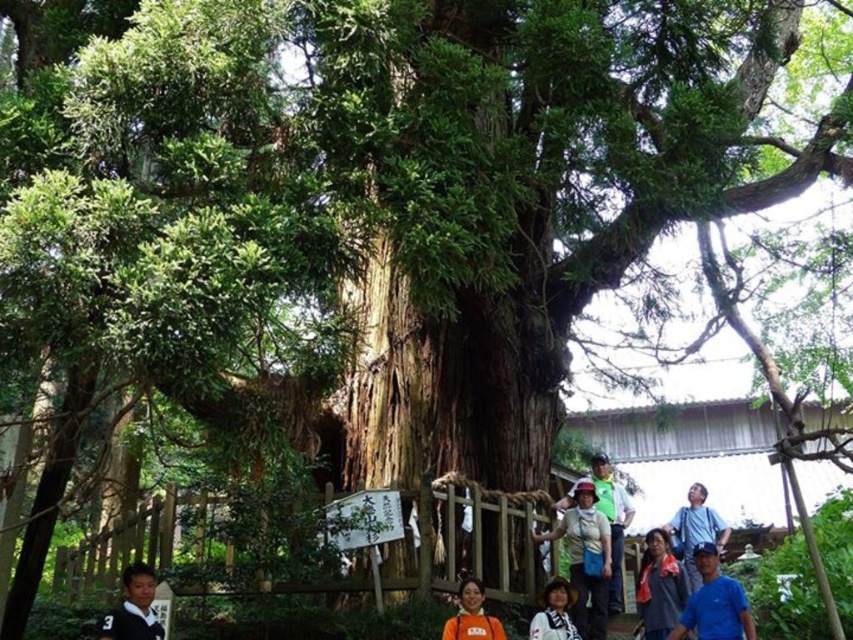
Question: Estimate the real-world distances between objects in this image. Which object is closer to the matte black shirt at lower left?

Choices:
 (A) matte black shirt at lower center
 (B) blue shirt at lower right
 (C) blue fabric shirt at lower right

Answer: (C)

Question: Can you confirm if matte blue shirt at center is thinner than matte black shirt at lower left?

Choices:
 (A) yes
 (B) no

Answer: (B)

Question: Can you confirm if blue shirt at lower right is positioned to the right of white fabric hat at lower center?

Choices:
 (A) no
 (B) yes

Answer: (B)

Question: Which is nearer to the matte blue shirt at center?

Choices:
 (A) matte black shirt at lower center
 (B) blue fabric shirt at lower right

Answer: (A)

Question: Is blue fabric shirt at lower right to the right of blue shirt at lower right from the viewer's perspective?

Choices:
 (A) yes
 (B) no

Answer: (B)

Question: Which point appears closest to the camera in this image?

Choices:
 (A) (664, 605)
 (B) (488, 614)
 (C) (599, 484)
 (D) (585, 621)

Answer: (B)